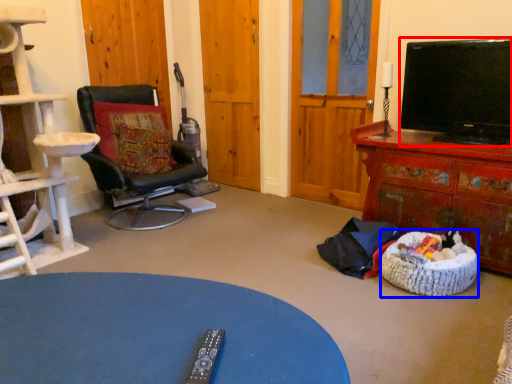
Question: Which object appears closest to the camera in this image, television (highlighted by a red box) or dog bed (highlighted by a blue box)?

Choices:
 (A) television
 (B) dog bed

Answer: (B)